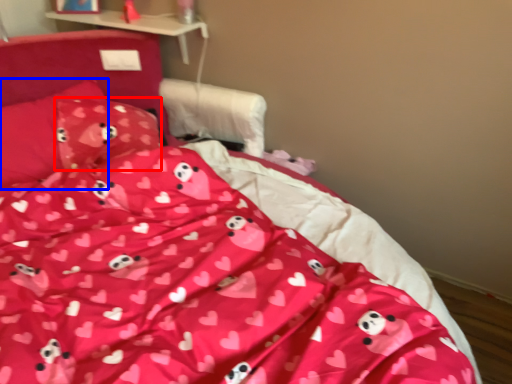
Question: Which object appears closest to the camera in this image, pillow (highlighted by a red box) or pillow (highlighted by a blue box)?

Choices:
 (A) pillow
 (B) pillow

Answer: (B)